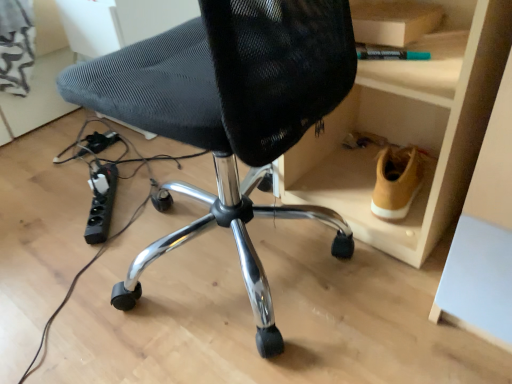
Question: Can you confirm if black plastic power strip at lower left, which ranks as the 2th plug in top-to-bottom order, is taller than black mesh chair at center?

Choices:
 (A) yes
 (B) no

Answer: (B)

Question: Is black plastic power strip at lower left, the first plug viewed from the front, positioned in front of black mesh chair at center?

Choices:
 (A) yes
 (B) no

Answer: (B)

Question: Considering the relative sizes of black plastic power strip at lower left, which is the second plug in back-to-front order, and black mesh chair at center in the image provided, is black plastic power strip at lower left, which is the second plug in back-to-front order, wider than black mesh chair at center?

Choices:
 (A) no
 (B) yes

Answer: (A)

Question: Does black plastic power strip at lower left, which ranks as the 2th plug in top-to-bottom order, have a lesser width compared to black mesh chair at center?

Choices:
 (A) yes
 (B) no

Answer: (A)

Question: Considering the relative sizes of black plastic power strip at lower left, the second plug when ordered from left to right, and black mesh chair at center in the image provided, is black plastic power strip at lower left, the second plug when ordered from left to right, shorter than black mesh chair at center?

Choices:
 (A) no
 (B) yes

Answer: (B)

Question: Is black plastic power strip at lower left, which ranks as the 2th plug in top-to-bottom order, to the left of black mesh chair at center from the viewer's perspective?

Choices:
 (A) yes
 (B) no

Answer: (A)

Question: Considering the relative sizes of tan suede shoe at lower right and black plastic plug at lower left, placed as the first plug when sorted from back to front, in the image provided, is tan suede shoe at lower right taller than black plastic plug at lower left, placed as the first plug when sorted from back to front,?

Choices:
 (A) yes
 (B) no

Answer: (A)

Question: Is tan suede shoe at lower right located outside black plastic plug at lower left, which is the 2th plug in right-to-left order?

Choices:
 (A) yes
 (B) no

Answer: (A)

Question: Is tan suede shoe at lower right positioned far away from black plastic plug at lower left, placed as the first plug when sorted from back to front?

Choices:
 (A) no
 (B) yes

Answer: (A)

Question: Is tan suede shoe at lower right thinner than black plastic plug at lower left, which is the 2th plug in right-to-left order?

Choices:
 (A) yes
 (B) no

Answer: (B)

Question: Does tan suede shoe at lower right appear on the right side of black plastic plug at lower left, positioned as the second plug in front-to-back order?

Choices:
 (A) yes
 (B) no

Answer: (A)

Question: Is tan suede shoe at lower right bigger than black plastic plug at lower left, acting as the 2th plug starting from the bottom?

Choices:
 (A) yes
 (B) no

Answer: (A)

Question: Is black mesh chair at center smaller than black plastic plug at lower left, placed as the first plug when sorted from left to right?

Choices:
 (A) yes
 (B) no

Answer: (B)